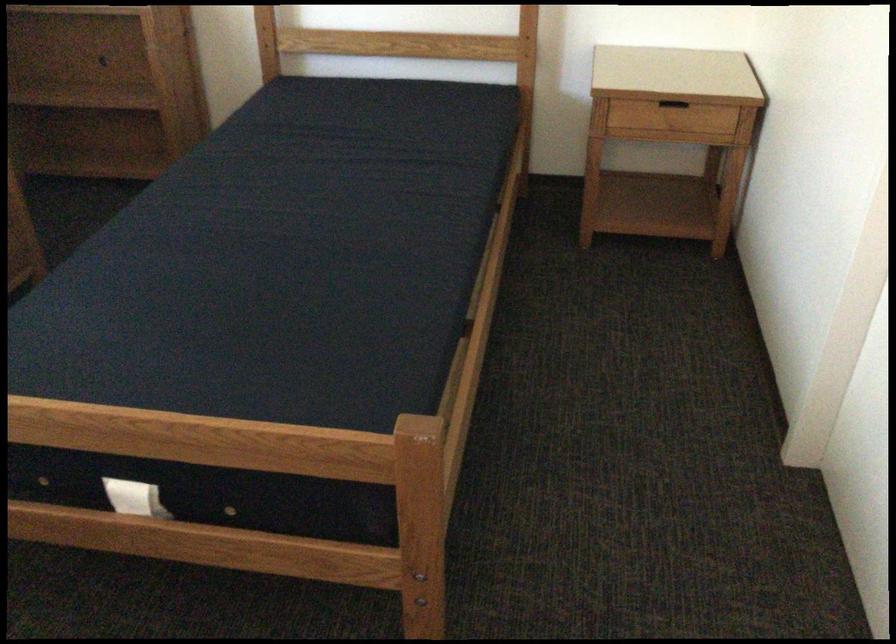
Describe the element at coordinates (673, 109) in the screenshot. I see `the dark drawer handle` at that location.